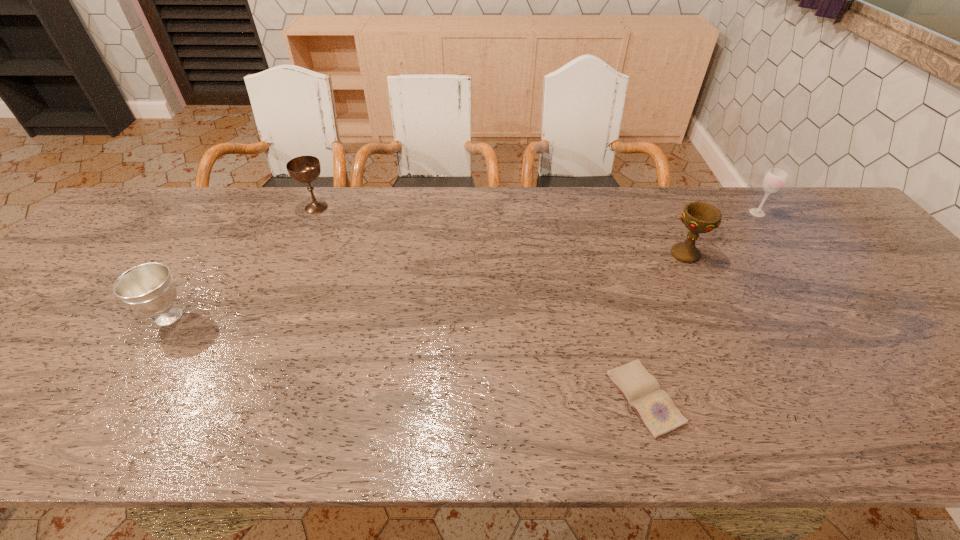
Locate an element on the screen. This screenshot has height=540, width=960. the third closest object to the wineglass is located at coordinates (304, 169).

Point out which object is positioned as the nearest to the diary. Please provide its 2D coordinates. Your answer should be formatted as a tuple, i.e. [(x, y)], where the tuple contains the x and y coordinates of a point satisfying the conditions above.

[(698, 217)]

Image resolution: width=960 pixels, height=540 pixels. What are the coordinates of `chalice that is the closest to the third farthest object` in the screenshot? It's located at (304, 169).

Point out which chalice is positioned as the nearest to the leftmost object. Please provide its 2D coordinates. Your answer should be formatted as a tuple, i.e. [(x, y)], where the tuple contains the x and y coordinates of a point satisfying the conditions above.

[(304, 169)]

Locate an element on the screen. vacant region that satisfies the following two spatial constraints: 1. on the back side of the wineglass; 2. on the right side of the nearest object is located at coordinates (590, 213).

Locate an element on the screen. The height and width of the screenshot is (540, 960). blank space that satisfies the following two spatial constraints: 1. on the front side of the fourth object from right to left; 2. on the left side of the rightmost chalice is located at coordinates (296, 254).

What are the coordinates of `free point that satisfies the following two spatial constraints: 1. on the back side of the rightmost object; 2. on the right side of the leftmost object` in the screenshot? It's located at (236, 213).

Where is `vacant point that satisfies the following two spatial constraints: 1. on the front side of the shortest object; 2. on the left side of the fourth object from right to left`? vacant point that satisfies the following two spatial constraints: 1. on the front side of the shortest object; 2. on the left side of the fourth object from right to left is located at coordinates (232, 399).

Where is `vacant space that satisfies the following two spatial constraints: 1. on the back side of the third object from right to left; 2. on the right side of the second object from right to left`? The width and height of the screenshot is (960, 540). vacant space that satisfies the following two spatial constraints: 1. on the back side of the third object from right to left; 2. on the right side of the second object from right to left is located at coordinates (603, 254).